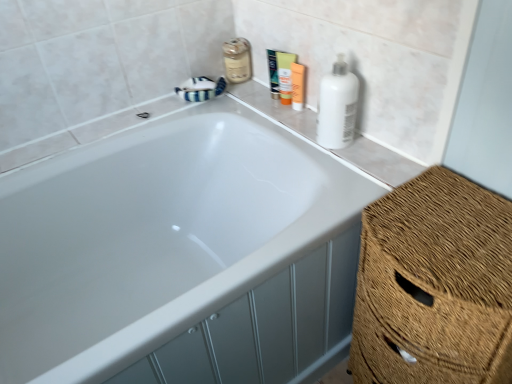
Where is `free point in front of white matte bottle at upper right`? Image resolution: width=512 pixels, height=384 pixels. free point in front of white matte bottle at upper right is located at coordinates (364, 163).